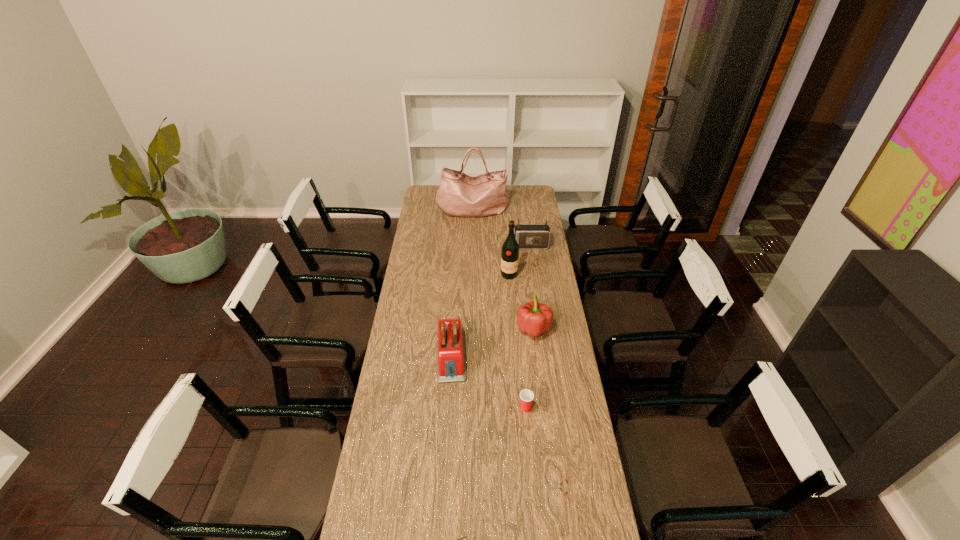
You are a GUI agent. You are given a task and a screenshot of the screen. Output one action in this format:
    pyautogui.click(x=<x>, y=<y>)
    Task: Click on the shortest object
    
    Given the screenshot: What is the action you would take?
    pyautogui.click(x=557, y=486)

The image size is (960, 540). Find the location of `vacant region located at the front of the handbag with handles`. vacant region located at the front of the handbag with handles is located at coordinates (472, 237).

Locate an element on the screen. The width and height of the screenshot is (960, 540). free space located 0.240m on the front-facing side of the third farthest object is located at coordinates (512, 315).

This screenshot has height=540, width=960. Find the location of `free region located 0.160m on the front of the toaster`. free region located 0.160m on the front of the toaster is located at coordinates (446, 420).

Where is `vacant space located at the lens of the camcorder`? The image size is (960, 540). vacant space located at the lens of the camcorder is located at coordinates (461, 246).

This screenshot has width=960, height=540. Identify the location of vacant space located 0.080m at the lens of the camcorder. (493, 246).

Identify the location of vacant space situated at the lens of the camcorder. (465, 246).

Identify the location of vacant space situated 0.360m on the back of the bell pepper. (526, 266).

Where is `free space located 0.220m on the left of the Dixie cup`? This screenshot has width=960, height=540. free space located 0.220m on the left of the Dixie cup is located at coordinates (460, 408).

Locate an element on the screen. The image size is (960, 540). free space located 0.160m on the back of the shortest object is located at coordinates (555, 432).